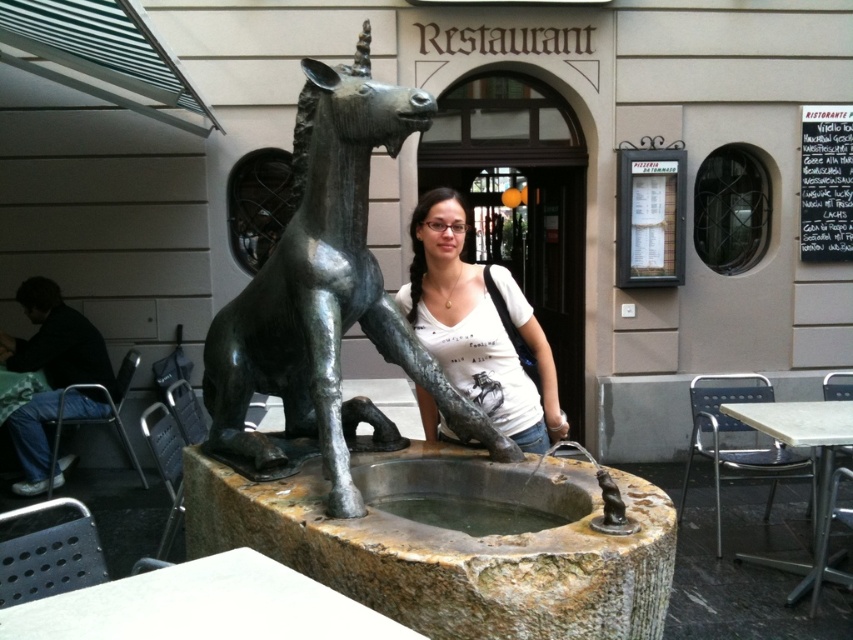
Is point (416, 227) less distant than point (91, 356)?

Yes, point (416, 227) is closer to viewer.

Is matte bronze unicorn at center to the right of dark blue fabric at left from the viewer's perspective?

Correct, you'll find matte bronze unicorn at center to the right of dark blue fabric at left.

Locate an element on the screen. Image resolution: width=853 pixels, height=640 pixels. matte bronze unicorn at center is located at coordinates (477, 326).

Does bronze unicorn at center have a lesser width compared to dark blue fabric at left?

In fact, bronze unicorn at center might be wider than dark blue fabric at left.

Between bronze unicorn at center and dark blue fabric at left, which one is positioned higher?

bronze unicorn at center

Is point (277, 264) positioned after point (13, 352)?

No.

You are a GUI agent. You are given a task and a screenshot of the screen. Output one action in this format:
    pyautogui.click(x=<x>, y=<y>)
    Task: Click on the bronze unicorn at center
    Image resolution: width=853 pixels, height=640 pixels.
    Given the screenshot: What is the action you would take?
    pyautogui.click(x=326, y=294)

Image resolution: width=853 pixels, height=640 pixels. I want to click on bronze unicorn at center, so click(326, 294).

Between point (212, 352) and point (490, 368), which one is positioned behind?

The point (490, 368) is more distant.

The image size is (853, 640). Identify the location of bronze unicorn at center. (326, 294).